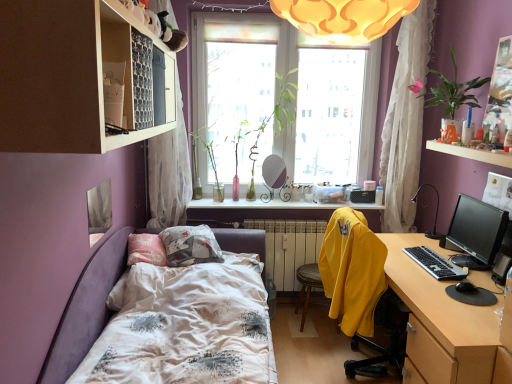
Question: Which direction should I rotate to look at translucent glass vase at upper center, positioned as the first window sill in front-to-back order?

Choices:
 (A) left
 (B) right

Answer: (B)

Question: From the image's perspective, is black glossy monitor at right located beneath pink glass vase at window, which is the 2th plant in left-to-right order?

Choices:
 (A) yes
 (B) no

Answer: (A)

Question: Can you confirm if black glossy monitor at right is shorter than pink glass vase at window, which is the 2th plant in left-to-right order?

Choices:
 (A) no
 (B) yes

Answer: (B)

Question: Can you confirm if black glossy monitor at right is positioned to the left of pink glass vase at window, arranged as the third plant when viewed from the right?

Choices:
 (A) no
 (B) yes

Answer: (A)

Question: Does black glossy monitor at right have a greater height compared to pink glass vase at window, arranged as the third plant when viewed from the right?

Choices:
 (A) no
 (B) yes

Answer: (A)

Question: Is black glossy monitor at right smaller than pink glass vase at window, arranged as the third plant when viewed from the right?

Choices:
 (A) yes
 (B) no

Answer: (A)

Question: Is black glossy monitor at right located outside pink glass vase at window, arranged as the third plant when viewed from the right?

Choices:
 (A) no
 (B) yes

Answer: (B)

Question: Does wooden desk at right touch matte white shelf at upper left?

Choices:
 (A) no
 (B) yes

Answer: (A)

Question: Is the position of wooden desk at right less distant than that of matte white shelf at upper left?

Choices:
 (A) yes
 (B) no

Answer: (B)

Question: Is wooden desk at right positioned with its back to matte white shelf at upper left?

Choices:
 (A) no
 (B) yes

Answer: (A)

Question: Considering the relative positions of wooden desk at right and matte white shelf at upper left in the image provided, is wooden desk at right to the right of matte white shelf at upper left from the viewer's perspective?

Choices:
 (A) no
 (B) yes

Answer: (B)

Question: Are wooden desk at right and matte white shelf at upper left far apart?

Choices:
 (A) no
 (B) yes

Answer: (B)

Question: Considering the relative sizes of wooden desk at right and matte white shelf at upper left in the image provided, is wooden desk at right taller than matte white shelf at upper left?

Choices:
 (A) yes
 (B) no

Answer: (A)

Question: From the image's perspective, is pink glass vase at window, arranged as the third plant when viewed from the right, above black plastic keyboard at right?

Choices:
 (A) yes
 (B) no

Answer: (A)